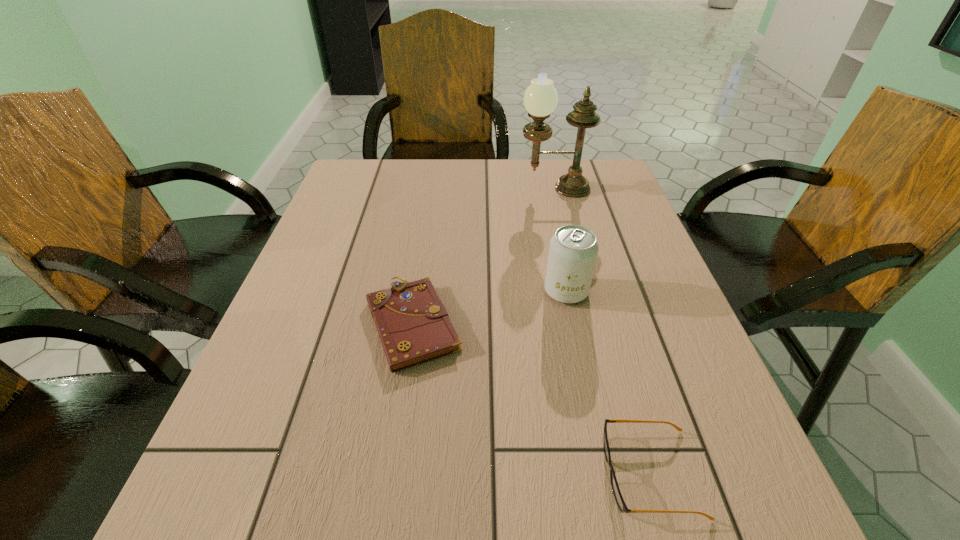
Locate an element on the screen. This screenshot has width=960, height=540. vacant space situated 0.120m on the front-facing side of the spectacles is located at coordinates (523, 473).

Image resolution: width=960 pixels, height=540 pixels. In order to click on vacant region located on the right of the leftmost object in this screenshot , I will do `click(493, 323)`.

Locate an element on the screen. object that is at the far edge is located at coordinates (540, 99).

Where is `object located in the near edge section of the desktop`? Image resolution: width=960 pixels, height=540 pixels. object located in the near edge section of the desktop is located at coordinates (619, 499).

What are the coordinates of `oil lamp that is at the right edge` in the screenshot? It's located at (540, 99).

Where is `spectacles situated at the right edge`? The width and height of the screenshot is (960, 540). spectacles situated at the right edge is located at coordinates [x=619, y=499].

Where is `object situated at the far right corner`? The width and height of the screenshot is (960, 540). object situated at the far right corner is located at coordinates (540, 99).

Find the location of a particular element. The height and width of the screenshot is (540, 960). object located in the near right corner section of the desktop is located at coordinates (619, 499).

Find the location of a particular element. The height and width of the screenshot is (540, 960). free region at the far edge is located at coordinates (394, 200).

The image size is (960, 540). In the image, there is a desktop. Find the location of `free space at the near edge`. free space at the near edge is located at coordinates (652, 536).